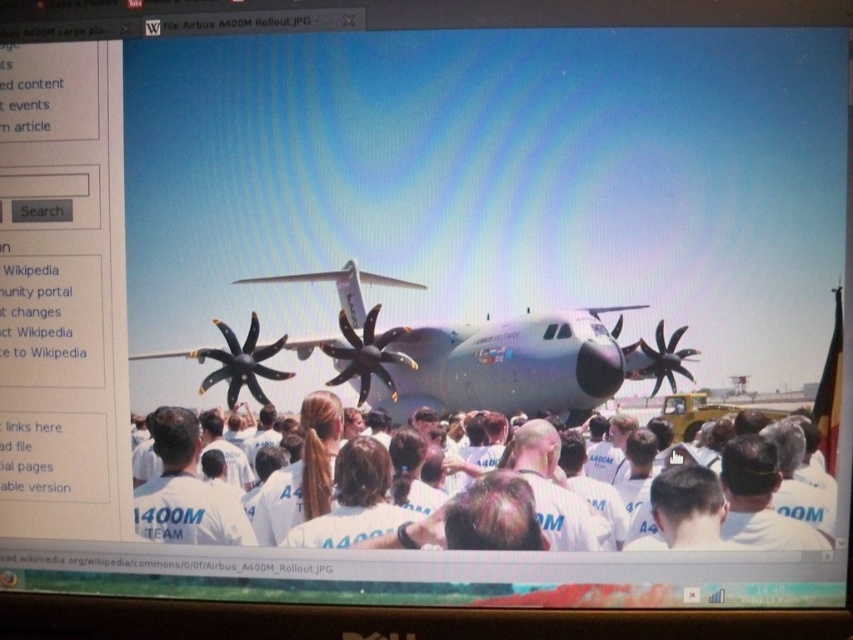
Who is taller, silver metallic airplane at center or white cotton shirt at center?

Standing taller between the two is silver metallic airplane at center.

Can you confirm if silver metallic airplane at center is shorter than white cotton shirt at center?

No, silver metallic airplane at center is not shorter than white cotton shirt at center.

Describe the element at coordinates (477, 355) in the screenshot. Image resolution: width=853 pixels, height=640 pixels. I see `silver metallic airplane at center` at that location.

You are a GUI agent. You are given a task and a screenshot of the screen. Output one action in this format:
    pyautogui.click(x=<x>, y=<y>)
    Task: Click on the silver metallic airplane at center
    This screenshot has width=853, height=640.
    Given the screenshot: What is the action you would take?
    pyautogui.click(x=477, y=355)

Does silver metallic airplane at center have a lesser width compared to white cotton shirts at center?

Yes, silver metallic airplane at center is thinner than white cotton shirts at center.

Is silver metallic airplane at center further to camera compared to white cotton shirts at center?

Yes.

Is point (505, 333) behind point (231, 484)?

No, it is not.

What are the coordinates of `silver metallic airplane at center` in the screenshot? It's located at (477, 355).

Does white cotton shirt at center appear on the right side of white cotton shirts at center?

Incorrect, white cotton shirt at center is not on the right side of white cotton shirts at center.

Does white cotton shirt at center have a smaller size compared to white cotton shirts at center?

Indeed, white cotton shirt at center has a smaller size compared to white cotton shirts at center.

Locate an element on the screen. The image size is (853, 640). white cotton shirt at center is located at coordinates (184, 490).